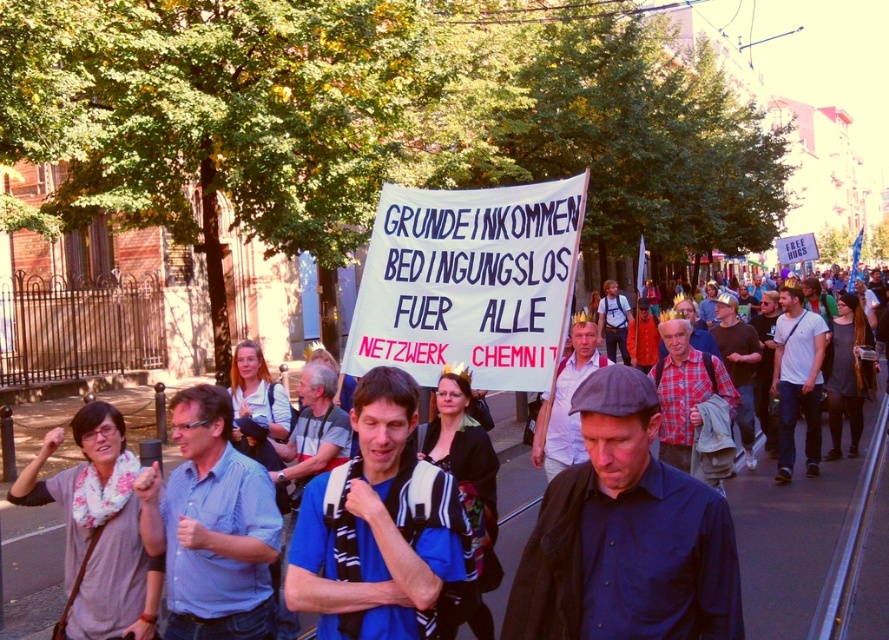
Find the location of a particular element. The width and height of the screenshot is (889, 640). white paper sign at center is located at coordinates (787, 541).

Between point (845, 490) and point (811, 387), which one is positioned in front?

Positioned in front is point (845, 490).

Find the location of a particular element. The height and width of the screenshot is (640, 889). white paper sign at center is located at coordinates pos(787,541).

Between point (654, 636) and point (739, 342), which one is positioned behind?

Positioned behind is point (739, 342).

Is dark blue fabric at center above dark blue shirt at center?

Actually, dark blue fabric at center is below dark blue shirt at center.

Identify the location of dark blue fabric at center. (625, 536).

Which is more to the left, dark blue fabric at center or blue fabric shirt at center?

blue fabric shirt at center

Is point (574, 484) behind point (297, 486)?

That is False.

Locate an element on the screen. This screenshot has height=640, width=889. dark blue fabric at center is located at coordinates (625, 536).